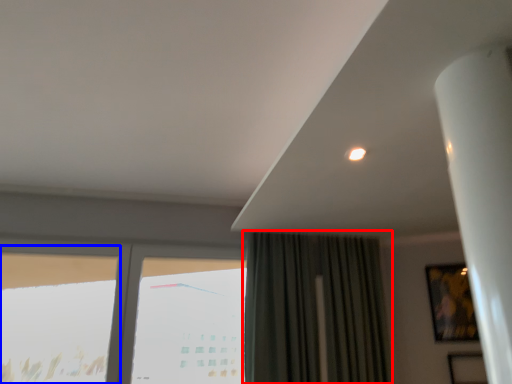
Question: Among these objects, which one is nearest to the camera, curtain (highlighted by a red box) or window (highlighted by a blue box)?

Choices:
 (A) curtain
 (B) window

Answer: (B)